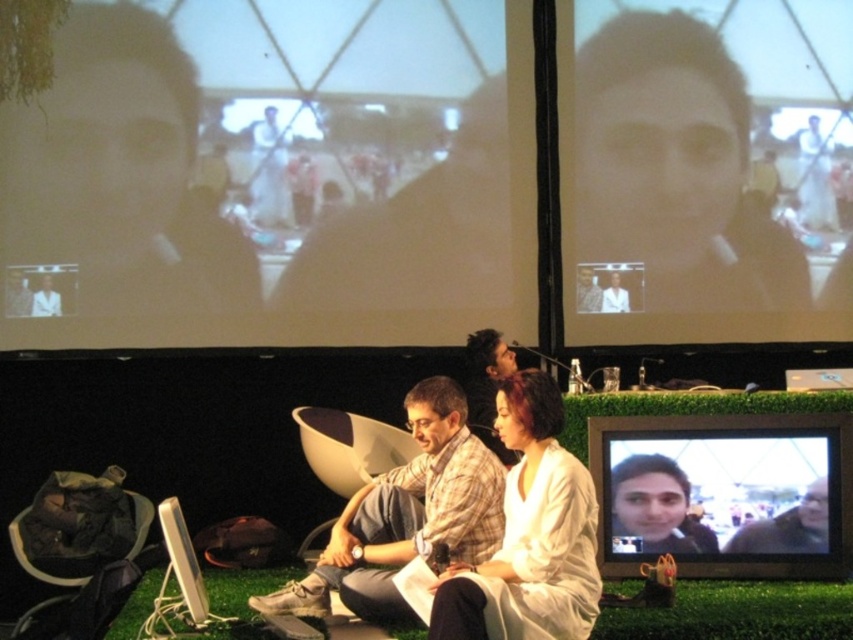
You are a photographer at the event and want to capture a photo where the white matte dress at center is positioned to the right of the matte black face at center. Is this possible based on their current arrangement?

The white matte dress at center is currently to the left of the matte black face at center, so to achieve the desired composition, the photographer would need to adjust their positions or angle the camera to reposition them in the frame.

Looking at this image, you are a photographer positioned behind the stage. You want to take a photo that includes both the plaid fabric shirt at center and the matte black laptop at center. Which object will appear larger in the photo?

The plaid fabric shirt at center will appear larger in the photo because it is closer to the viewer than the matte black laptop at center.